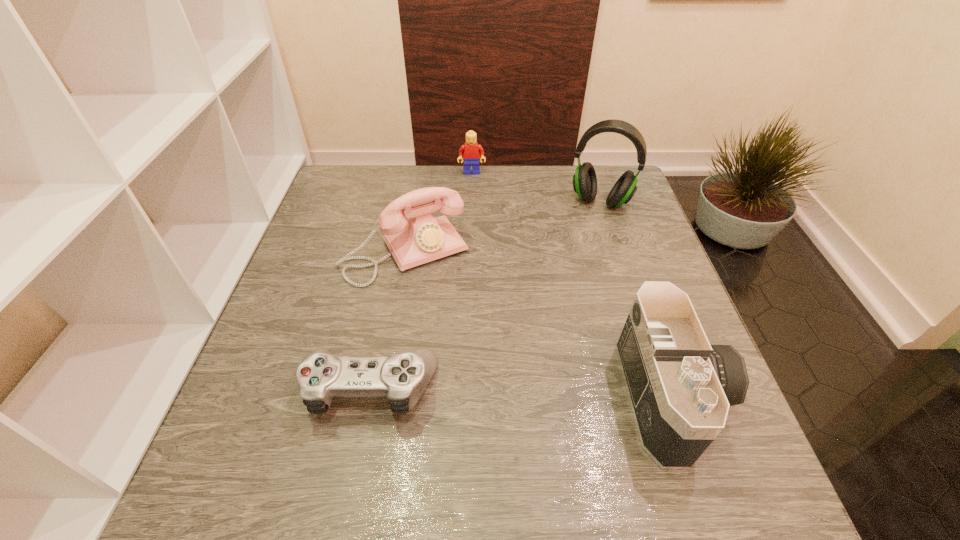
Where is `vacant region between the third farthest object and the shortest object`? This screenshot has width=960, height=540. vacant region between the third farthest object and the shortest object is located at coordinates pos(388,320).

You are a GUI agent. You are given a task and a screenshot of the screen. Output one action in this format:
    pyautogui.click(x=<x>, y=<y>)
    Task: Click on the empty space between the Lego and the third nearest object
    
    Given the screenshot: What is the action you would take?
    pyautogui.click(x=439, y=212)

Find the location of a particular element. Image resolution: width=960 pixels, height=540 pixels. object that is the nearest to the telephone is located at coordinates (403, 377).

Identify the location of object that is the second closest one to the control. The width and height of the screenshot is (960, 540). (680, 387).

At what (x,y) coordinates should I click in order to perform the action: click on free point that satisfies the following two spatial constraints: 1. on the back side of the third nearest object; 2. on the left side of the second shortest object. Please return your answer as a coordinate pair (x, y). Looking at the image, I should click on (420, 173).

Where is `vacant space that satisfies the following two spatial constraints: 1. on the front side of the camera; 2. on the front-facing side of the headset`? Image resolution: width=960 pixels, height=540 pixels. vacant space that satisfies the following two spatial constraints: 1. on the front side of the camera; 2. on the front-facing side of the headset is located at coordinates (664, 395).

You are a GUI agent. You are given a task and a screenshot of the screen. Output one action in this format:
    pyautogui.click(x=<x>, y=<y>)
    Task: Click on the vacant area that satisfies the following two spatial constraints: 1. on the back side of the shortest object; 2. on the left side of the telephone
    The height and width of the screenshot is (540, 960).
    Given the screenshot: What is the action you would take?
    pyautogui.click(x=397, y=252)

The width and height of the screenshot is (960, 540). Find the location of `vacant space that satisfies the following two spatial constraints: 1. on the front side of the camera; 2. on the front-facing side of the control`. vacant space that satisfies the following two spatial constraints: 1. on the front side of the camera; 2. on the front-facing side of the control is located at coordinates (369, 395).